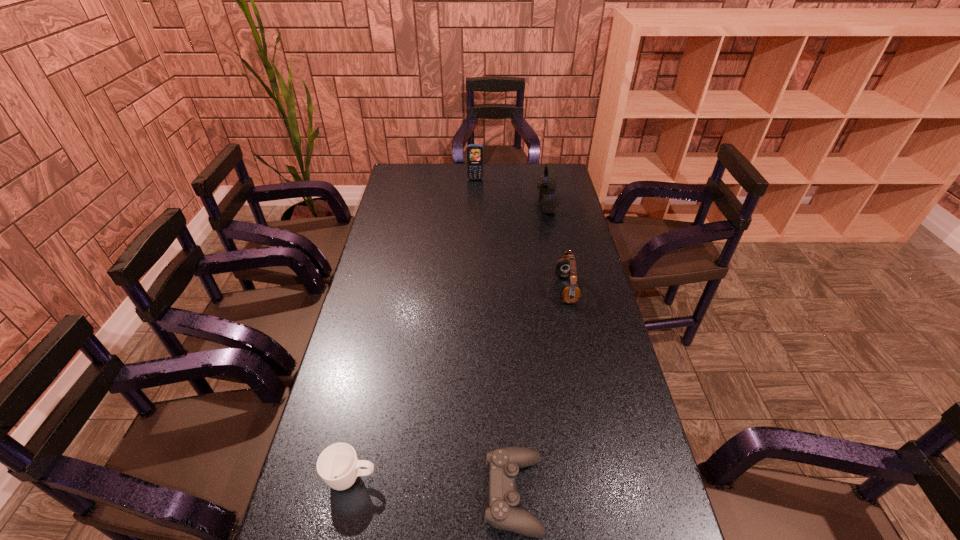
Find the location of a particular element. the second farthest object is located at coordinates (547, 188).

At what (x,y) coordinates should I click in order to perform the action: click on the taller headset. Please return your answer as a coordinate pair (x, y). Image resolution: width=960 pixels, height=540 pixels. Looking at the image, I should click on (547, 188).

Image resolution: width=960 pixels, height=540 pixels. Find the location of `the farthest object`. the farthest object is located at coordinates (475, 152).

Where is `the nearer headset`? the nearer headset is located at coordinates (566, 267).

Where is `the third shortest object`? The width and height of the screenshot is (960, 540). the third shortest object is located at coordinates (566, 267).

This screenshot has width=960, height=540. I want to click on the leftmost object, so click(338, 465).

The width and height of the screenshot is (960, 540). I want to click on cup, so click(x=338, y=465).

Where is `free space located 0.090m on the headband of the taller headset`? This screenshot has width=960, height=540. free space located 0.090m on the headband of the taller headset is located at coordinates (517, 204).

Where is `vacant point located on the headband of the taller headset`? This screenshot has width=960, height=540. vacant point located on the headband of the taller headset is located at coordinates (456, 204).

You are a GUI agent. You are given a task and a screenshot of the screen. Output one action in this format:
    pyautogui.click(x=<x>, y=<y>)
    Task: Click on the free space located 0.390m on the headband of the taller headset
    This screenshot has width=960, height=540.
    Given the screenshot: What is the action you would take?
    pyautogui.click(x=449, y=204)